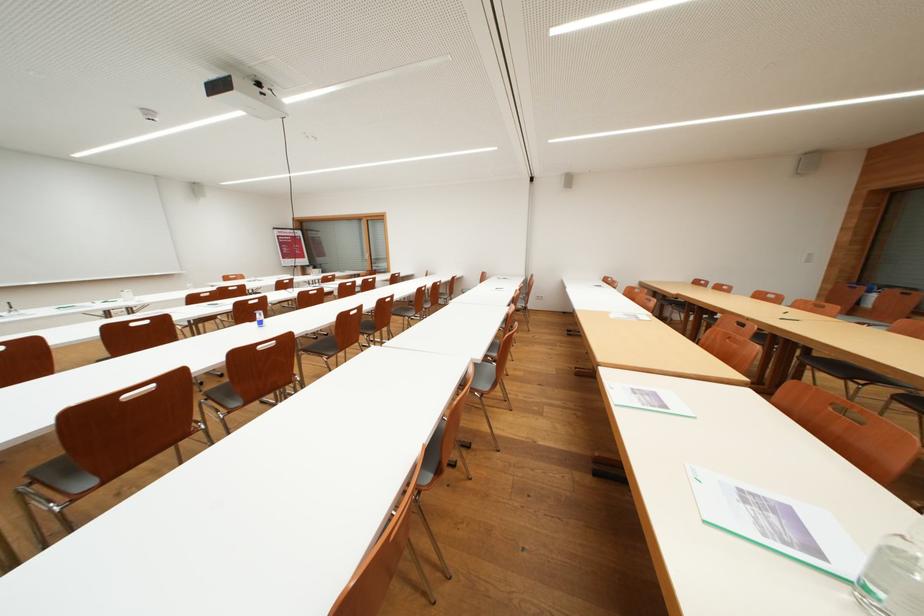
The location [259,317] corresponds to which object?

This point indicates the blue plastic cup.